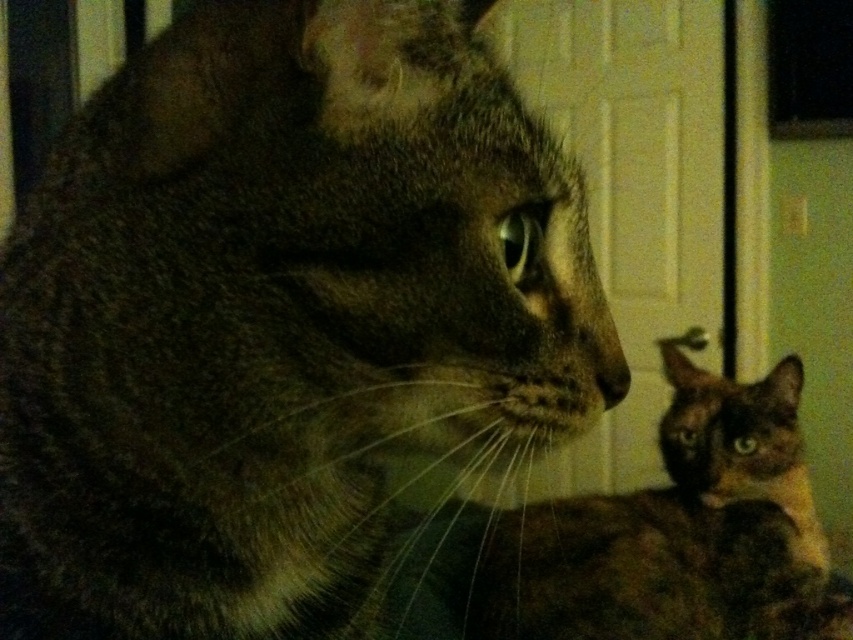
You are a photographer holding a camera. You want to take a photo of the dark brown fur cat at left from a distance that is exactly 40 centimeters. Can you move closer or farther away to achieve this?

The dark brown fur cat at left is currently 42.25 centimeters away from the camera. To achieve a distance of exactly 40 centimeters, you need to move the camera closer by 2.25 centimeters.

You are a veterinarian examining two cats in an indoor setting. The dark brown fur cat at left and the brown fur cat at lower right are both present. Based on their sizes, which cat might require a larger cage for accommodation?

The dark brown fur cat at left has a greater height compared to the brown fur cat at lower right, so it would require a larger cage for accommodation.

In the scene shown: You are a photographer trying to capture both cats in the scene. Since the dark brown fur cat at left and the brown fur cat at lower right are positioned differently, which cat is closer to the camera?

The dark brown fur cat at left is closer to the camera because it is in front of the brown fur cat at lower right.